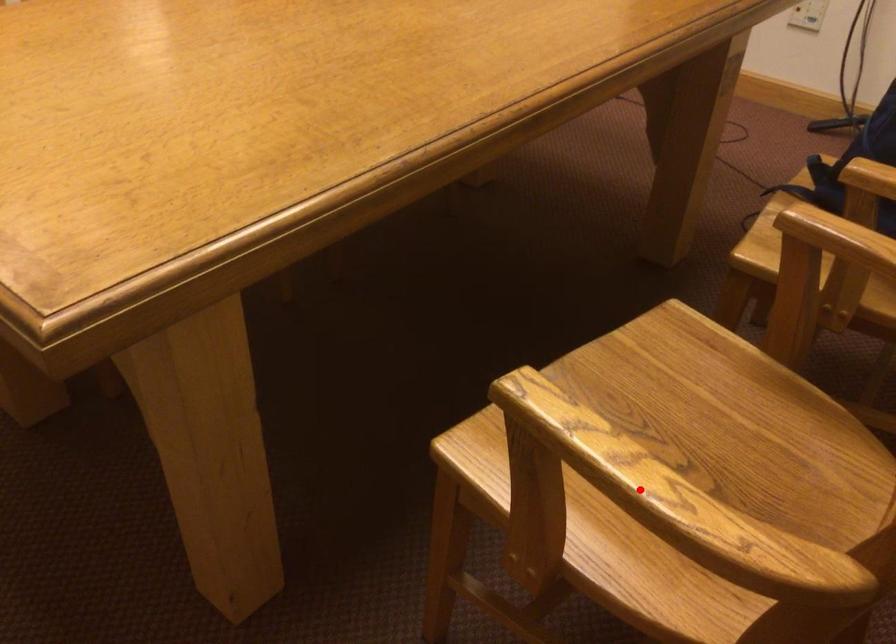
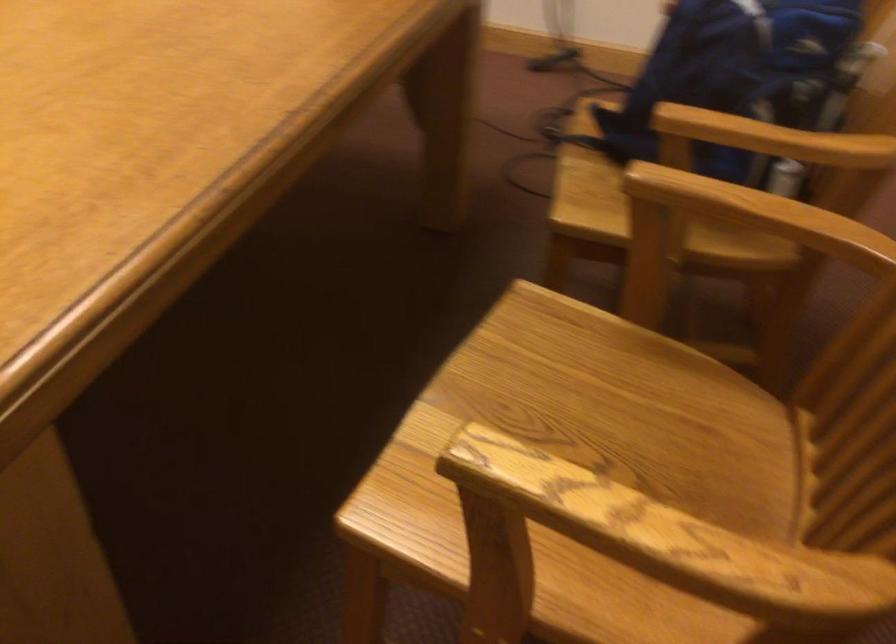
In the second image, find the point that corresponds to the highlighted location in the first image.

(658, 542)